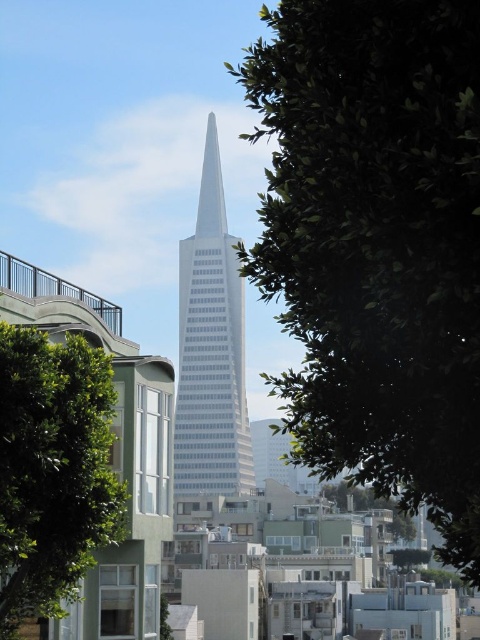
Question: Is green leafy tree at center thinner than green leafy tree at lower left?

Choices:
 (A) no
 (B) yes

Answer: (A)

Question: Can you confirm if green leafy tree at center is bigger than white glass skyscraper at center?

Choices:
 (A) yes
 (B) no

Answer: (B)

Question: Which point is closer to the camera?

Choices:
 (A) (460, 317)
 (B) (73, 369)
 (C) (200, 424)

Answer: (A)

Question: Which of these objects is positioned closest to the white glass skyscraper at center?

Choices:
 (A) green leafy tree at lower left
 (B) green leafy tree at center

Answer: (A)

Question: Which object appears closest to the camera in this image?

Choices:
 (A) green leafy tree at lower left
 (B) white glass skyscraper at center

Answer: (A)

Question: Is green leafy tree at center to the right of white glass skyscraper at center from the viewer's perspective?

Choices:
 (A) yes
 (B) no

Answer: (A)